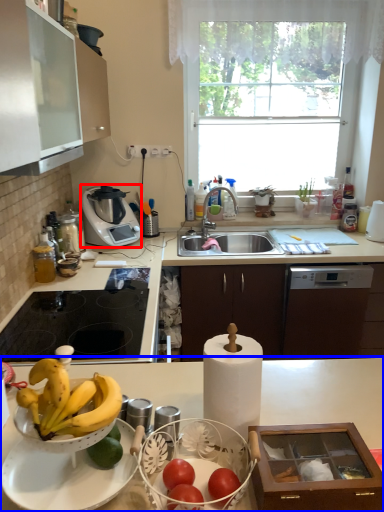
Question: Which of the following is the farthest to the observer, kitchen appliance (highlighted by a red box) or countertop (highlighted by a blue box)?

Choices:
 (A) kitchen appliance
 (B) countertop

Answer: (A)